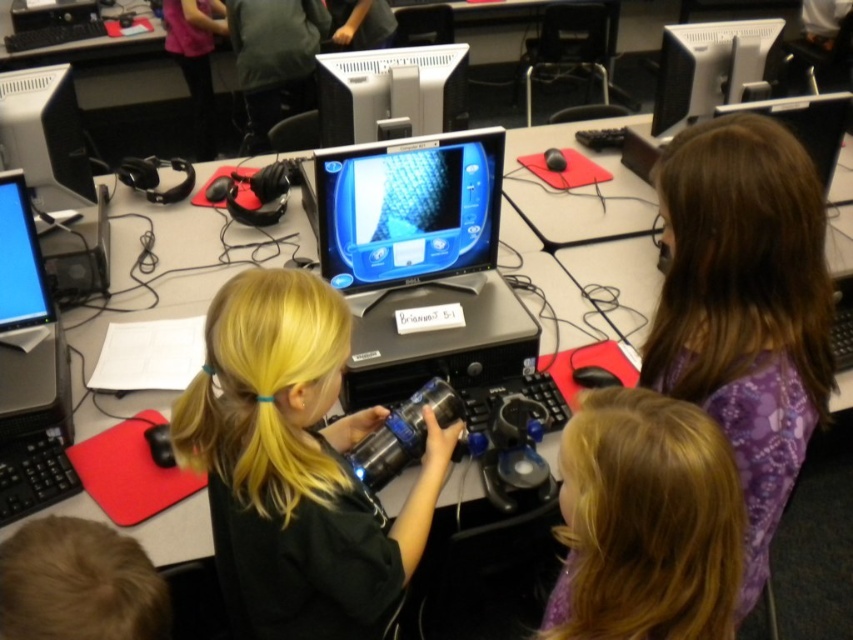
Question: Which point is farther to the camera?

Choices:
 (A) matte black monitor at upper right
 (B) satin black monitor at center

Answer: (A)

Question: Where is black matte laptop at center located in relation to matte black monitor at left in the image?

Choices:
 (A) below
 (B) above

Answer: (A)

Question: Among these points, which one is nearest to the camera?

Choices:
 (A) coord(16,163)
 (B) coord(39,280)
 (C) coord(329,144)

Answer: (B)

Question: Which point is farther to the camera?

Choices:
 (A) (393, 113)
 (B) (22, 324)
 (C) (701, 460)
 (D) (33, 134)

Answer: (A)

Question: Is blonde hair at center to the left of matte black monitor at upper right from the viewer's perspective?

Choices:
 (A) no
 (B) yes

Answer: (B)

Question: Is shiny black monitor at center further to the viewer compared to satin black monitor at center?

Choices:
 (A) yes
 (B) no

Answer: (B)